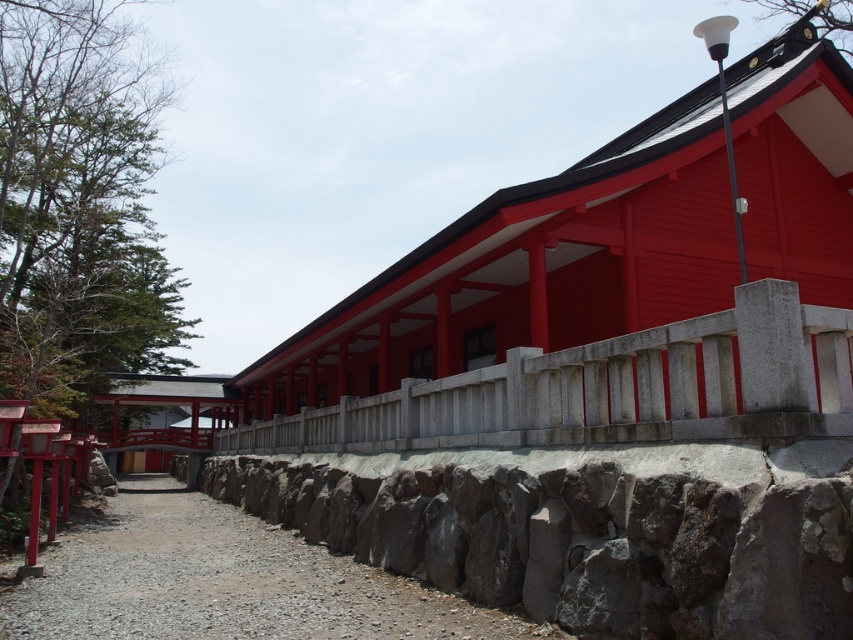
Can you confirm if gray rough stone wall at center is positioned to the left of gray stone railing at center?

Incorrect, gray rough stone wall at center is not on the left side of gray stone railing at center.

Between gray rough stone wall at center and gray stone railing at center, which one appears on the left side from the viewer's perspective?

Positioned to the left is gray stone railing at center.

The height and width of the screenshot is (640, 853). Describe the element at coordinates (585, 536) in the screenshot. I see `gray rough stone wall at center` at that location.

I want to click on gray rough stone wall at center, so click(585, 536).

I want to click on gray rough stone wall at center, so click(x=585, y=536).

Looking at this image, is gray rough stone wall at center further to the viewer compared to gray gravel path at center?

No, gray rough stone wall at center is closer to the viewer.

Who is more forward, (x=296, y=506) or (x=225, y=560)?

Point (x=225, y=560) is more forward.

The width and height of the screenshot is (853, 640). Find the location of `gray rough stone wall at center`. gray rough stone wall at center is located at coordinates (585, 536).

Who is positioned more to the left, gray stone railing at center or gray gravel path at center?

Positioned to the left is gray gravel path at center.

Is point (602, 340) positioned in front of point (265, 547)?

Yes, point (602, 340) is in front of point (265, 547).

I want to click on gray stone railing at center, so click(x=608, y=388).